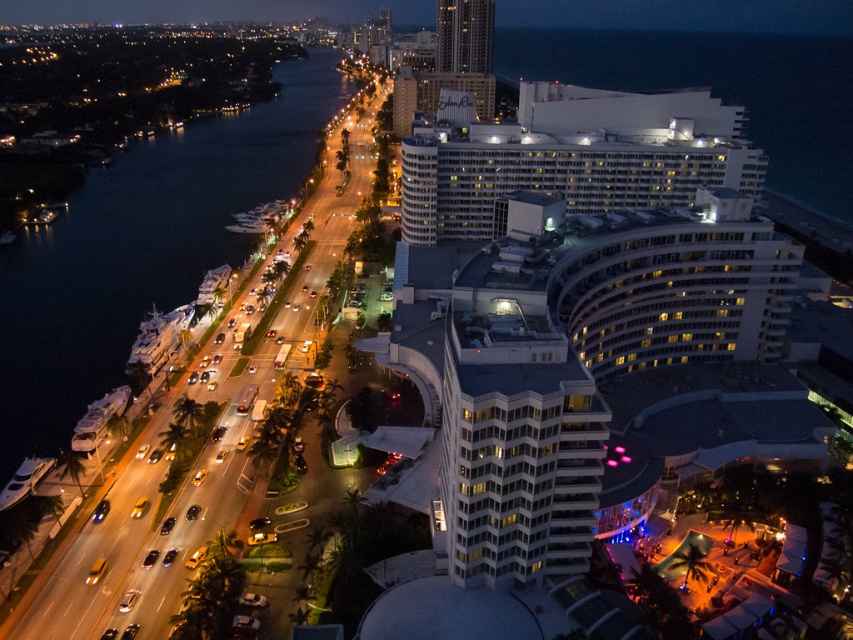
Question: Which object is the closest to the white glossy building at center?

Choices:
 (A) white glass building at upper center
 (B) dark blue water at left

Answer: (B)

Question: Observing the image, what is the correct spatial positioning of white glossy building at center in reference to white glass building at upper center?

Choices:
 (A) below
 (B) above

Answer: (A)

Question: Which object is positioned closest to the white glass building at upper center?

Choices:
 (A) dark blue water at left
 (B) white glossy building at center

Answer: (A)

Question: Which of the following is the closest to the observer?

Choices:
 (A) white glass building at upper center
 (B) dark blue water at left

Answer: (B)

Question: Observing the image, what is the correct spatial positioning of dark blue water at left in reference to white glass building at upper center?

Choices:
 (A) below
 (B) above

Answer: (A)

Question: Is white glossy building at center positioned behind white glass building at upper center?

Choices:
 (A) no
 (B) yes

Answer: (A)